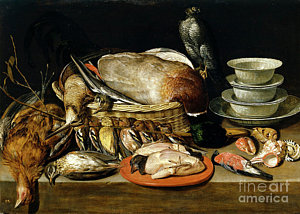
Image resolution: width=300 pixels, height=214 pixels. Find the location of `wall`. wall is located at coordinates (110, 23).